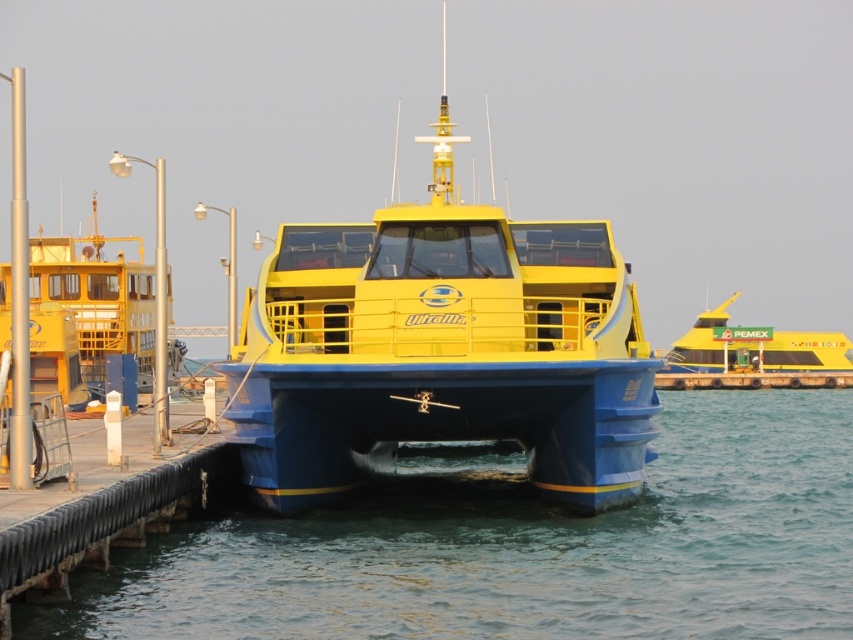
You are a sailor planning to board the yellow matte boat at left and the yellow matte boat at upper right. Based on their sizes, which one would you choose if you prefer a more spacious vessel for your trip?

The yellow matte boat at left is bigger than the yellow matte boat at upper right, so you should choose the yellow matte boat at left for a more spacious vessel.

You are standing on the wooden pier next to the UltraMar catamaran. There is a point marked at coordinates (523, 547). What is located at this point?

The point at coordinates (523, 547) marks blue rubber water at center.

You are a passenger on the pier and want to board the yellow matte boat at upper right. Which direction should you walk to reach it from the yellow matte boat at center?

The yellow matte boat at center is in front of the yellow matte boat at upper right, so you should walk backward or behind the yellow matte boat at center to reach the yellow matte boat at upper right.